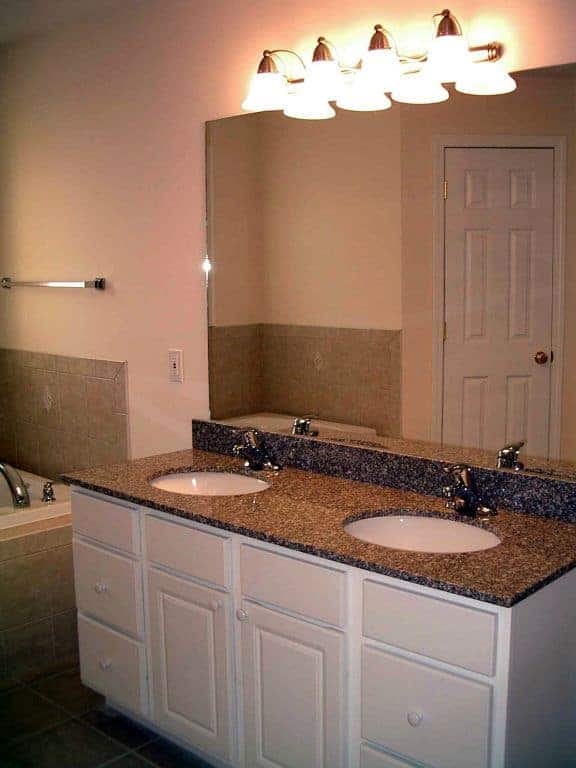
The height and width of the screenshot is (768, 576). I want to click on door reflection, so click(x=476, y=298).